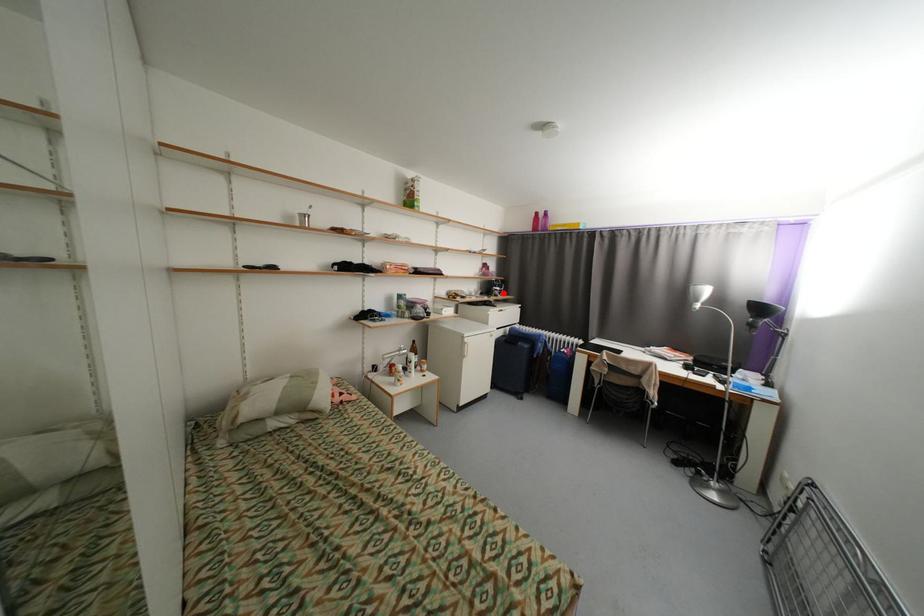
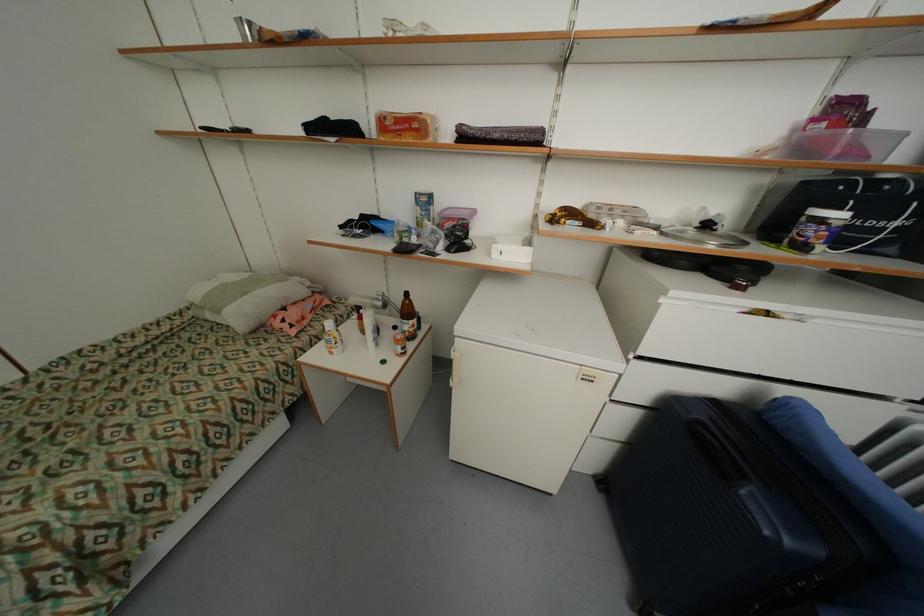
The point at the highlighted location is marked in the first image. Where is the corresponding point in the second image?

(819, 233)